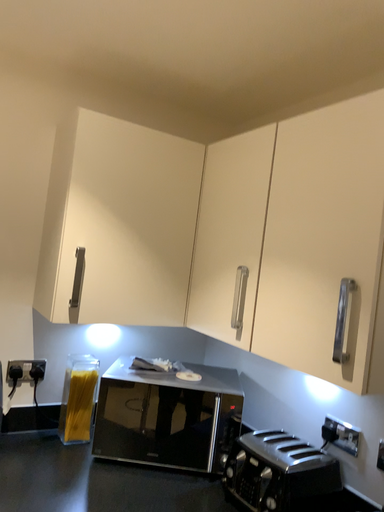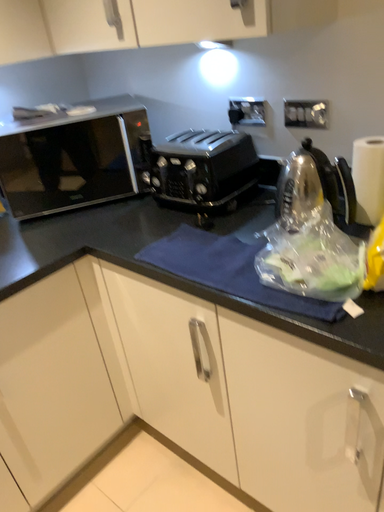
Question: Which way did the camera rotate in the video?

Choices:
 (A) rotated downward
 (B) rotated upward

Answer: (A)